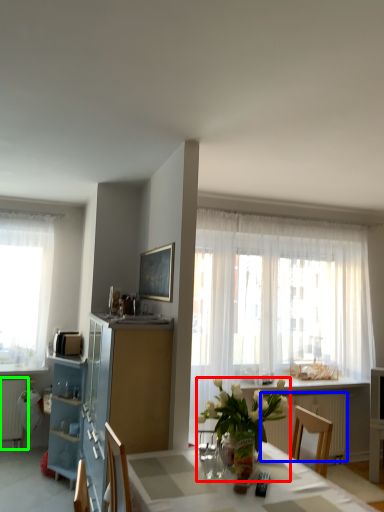
Question: Which object is positioned farthest from houseplant (highlighted by a red box)? Select from radiator (highlighted by a blue box) and radiator (highlighted by a green box).

Choices:
 (A) radiator
 (B) radiator

Answer: (B)